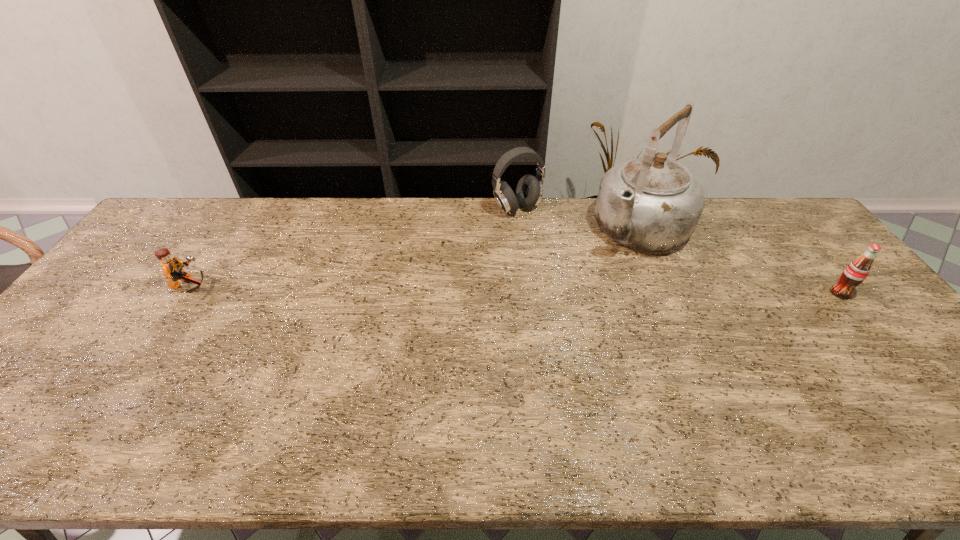
Identify the location of unoccupied position between the rightmost object and the tallest object. This screenshot has height=540, width=960. (740, 261).

I want to click on free spot between the soda and the second object from right to left, so click(740, 261).

Where is `vacant space in between the headset and the shortest object`? This screenshot has width=960, height=540. vacant space in between the headset and the shortest object is located at coordinates (354, 248).

Select which object is the closest to the third shortest object. Please provide its 2D coordinates. Your answer should be formatted as a tuple, i.e. [(x, y)], where the tuple contains the x and y coordinates of a point satisfying the conditions above.

[(650, 203)]

Where is `object that ranks as the closest to the headset`? This screenshot has height=540, width=960. object that ranks as the closest to the headset is located at coordinates (650, 203).

At what (x,y) coordinates should I click in order to perform the action: click on free space that satisfies the following two spatial constraints: 1. on the front side of the kettle; 2. on the right side of the third tallest object. Please return your answer as a coordinate pair (x, y). This screenshot has width=960, height=540. Looking at the image, I should click on (667, 293).